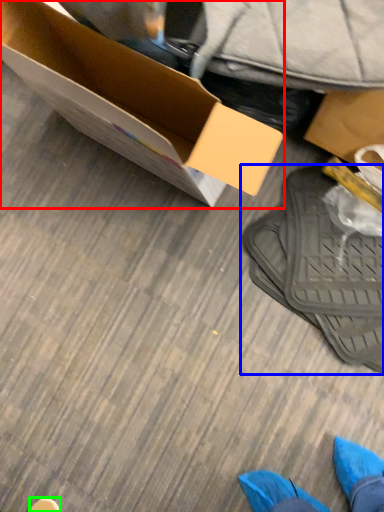
Question: Which is nearer to the box (highlighted by a red box)? footwear (highlighted by a blue box) or shoe (highlighted by a green box).

Choices:
 (A) footwear
 (B) shoe

Answer: (A)